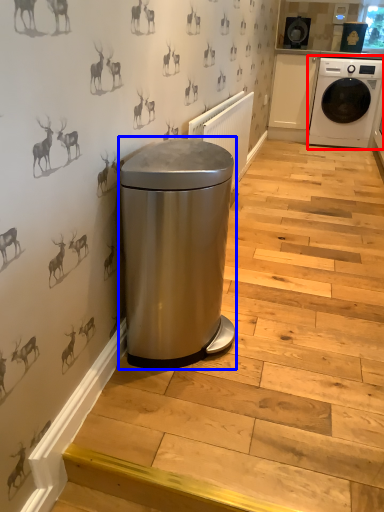
Question: Which object appears closest to the camera in this image, washing machine (highlighted by a red box) or water heater (highlighted by a blue box)?

Choices:
 (A) washing machine
 (B) water heater

Answer: (B)